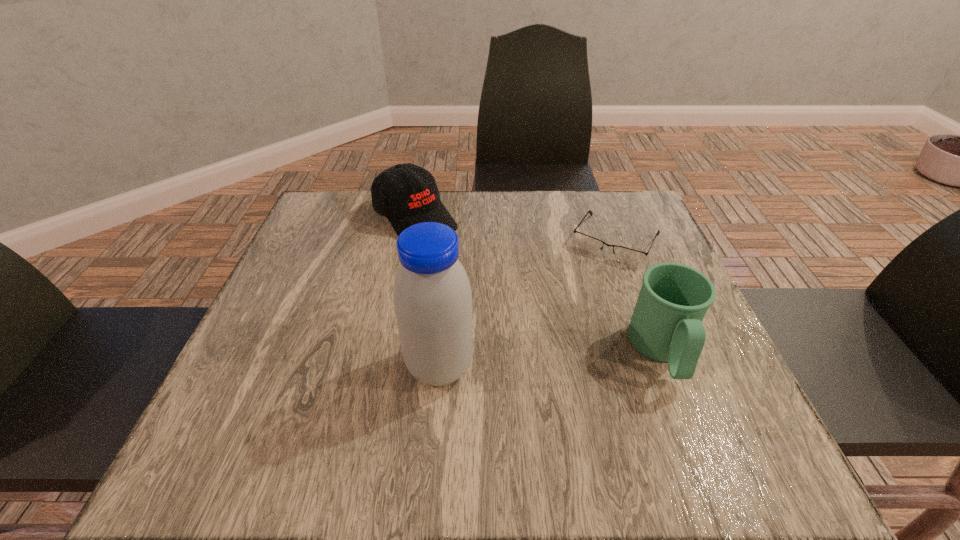
Locate an element on the screen. The height and width of the screenshot is (540, 960). free space on the desktop that is between the tallest object and the mug and is positioned on the front-facing side of the baseball cap is located at coordinates (578, 357).

This screenshot has width=960, height=540. Find the location of `vacant space on the desktop that is between the soya milk and the mug and is positioned on the front-facing side of the shortest object`. vacant space on the desktop that is between the soya milk and the mug and is positioned on the front-facing side of the shortest object is located at coordinates (548, 359).